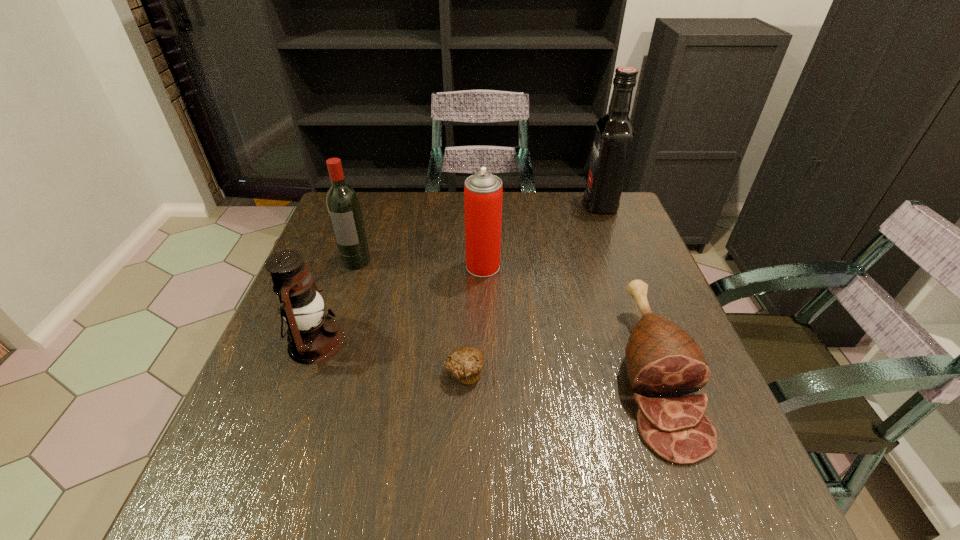
Locate an element on the screen. This screenshot has height=540, width=960. liquor is located at coordinates (614, 134).

The image size is (960, 540). In order to click on the tallest object in this screenshot , I will do `click(614, 134)`.

Where is `wine bottle`? The width and height of the screenshot is (960, 540). wine bottle is located at coordinates (343, 205).

I want to click on aerosol can, so click(x=483, y=191).

The width and height of the screenshot is (960, 540). What are the coordinates of `lantern` in the screenshot? It's located at (313, 337).

What are the coordinates of `ham` in the screenshot? It's located at (663, 360).

Where is `muffin`? Image resolution: width=960 pixels, height=540 pixels. muffin is located at coordinates (465, 363).

This screenshot has height=540, width=960. Find the location of `vacant space located 0.210m on the front-facing side of the liquor`. vacant space located 0.210m on the front-facing side of the liquor is located at coordinates (x=516, y=205).

Where is `vacant space located on the front-facing side of the liquor`? vacant space located on the front-facing side of the liquor is located at coordinates (542, 205).

I want to click on free space located on the front-facing side of the liquor, so click(503, 205).